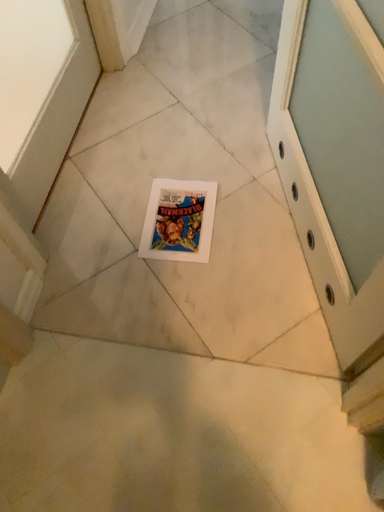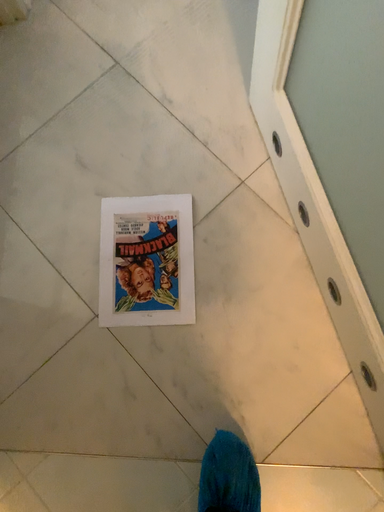
Question: How did the camera likely rotate when shooting the video?

Choices:
 (A) rotated upward
 (B) rotated downward

Answer: (B)